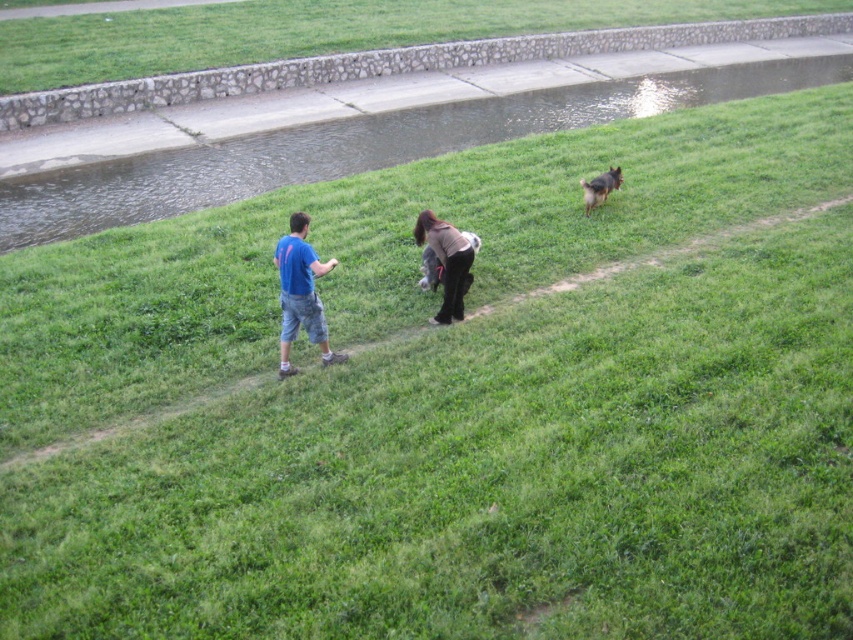
Is smooth concrete creek at upper center to the right of brown fur dog at upper right from the viewer's perspective?

Yes, smooth concrete creek at upper center is to the right of brown fur dog at upper right.

Who is lower down, smooth concrete creek at upper center or brown fur dog at upper right?

Positioned lower is brown fur dog at upper right.

Does point (286, 150) come farther from viewer compared to point (585, 193)?

Yes, it is.

Locate an element on the screen. The height and width of the screenshot is (640, 853). smooth concrete creek at upper center is located at coordinates (360, 147).

Does dark brown sweater at center appear on the right side of brown fur dog at upper right?

No, dark brown sweater at center is not to the right of brown fur dog at upper right.

Image resolution: width=853 pixels, height=640 pixels. Identify the location of dark brown sweater at center. (445, 262).

The image size is (853, 640). What do you see at coordinates (445, 262) in the screenshot?
I see `dark brown sweater at center` at bounding box center [445, 262].

Locate an element on the screen. dark brown sweater at center is located at coordinates (445, 262).

Based on the photo, is smooth concrete creek at upper center above short-haired brown dog at center?

Indeed, smooth concrete creek at upper center is positioned over short-haired brown dog at center.

Which is behind, point (137, 196) or point (421, 284)?

The point (137, 196) is more distant.

Between point (445, 116) and point (439, 275), which one is positioned behind?

The point (445, 116) is behind.

The image size is (853, 640). I want to click on smooth concrete creek at upper center, so click(360, 147).